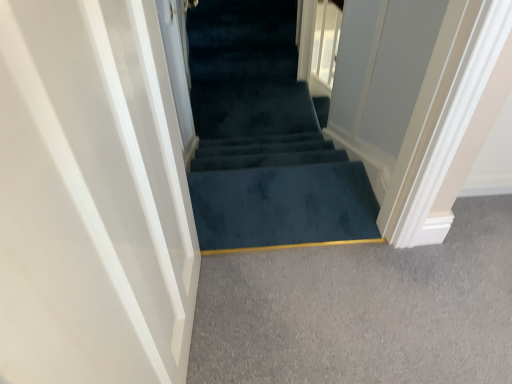
Question: Is teal carpeted stairs at center wider or thinner than white glossy door at left?

Choices:
 (A) thin
 (B) wide

Answer: (A)

Question: From the image's perspective, is teal carpeted stairs at center located above or below white glossy door at left?

Choices:
 (A) below
 (B) above

Answer: (B)

Question: From a real-world perspective, is teal carpeted stairs at center physically located above or below white glossy door at left?

Choices:
 (A) above
 (B) below

Answer: (B)

Question: In terms of height, does white glossy door at left look taller or shorter compared to teal carpeted stairs at center?

Choices:
 (A) short
 (B) tall

Answer: (B)

Question: From the image's perspective, is white glossy door at left positioned above or below teal carpeted stairs at center?

Choices:
 (A) above
 (B) below

Answer: (B)

Question: Is white glossy door at left in front of or behind teal carpeted stairs at center in the image?

Choices:
 (A) front
 (B) behind

Answer: (A)

Question: Choose the correct answer: Is white glossy door at left inside teal carpeted stairs at center or outside it?

Choices:
 (A) inside
 (B) outside

Answer: (B)